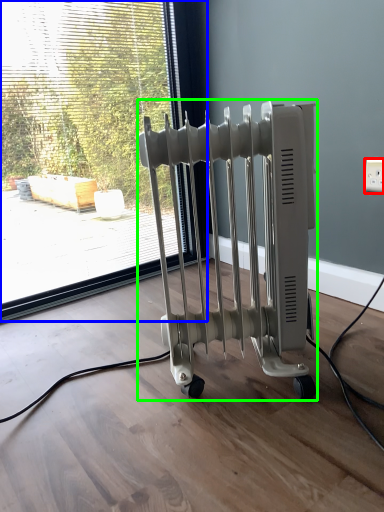
Question: Which object is the farthest from electric outlet (highlighted by a red box)? Choose among these: window (highlighted by a blue box) or bath heater (highlighted by a green box).

Choices:
 (A) window
 (B) bath heater

Answer: (A)